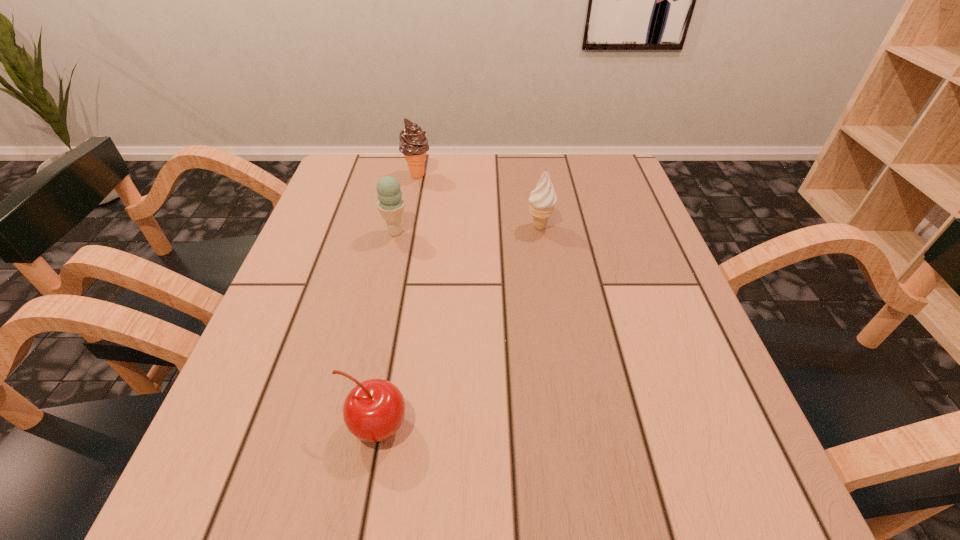
Where is `the farthest object`? the farthest object is located at coordinates pyautogui.click(x=413, y=143).

Identify the location of the rightmost ice cream. (542, 200).

The width and height of the screenshot is (960, 540). What are the coordinates of `the nearest object` in the screenshot? It's located at (374, 409).

I want to click on the shortest object, so click(x=374, y=409).

Identify the location of free region located 0.130m on the left of the farthest object. (354, 175).

The height and width of the screenshot is (540, 960). Find the location of `vacant space located 0.280m on the front-facing side of the rightmost object`. vacant space located 0.280m on the front-facing side of the rightmost object is located at coordinates (404, 227).

Identify the location of vacant space located 0.190m on the front-facing side of the rightmost object. The height and width of the screenshot is (540, 960). (444, 227).

Identify the location of vacant area located 0.300m on the front-facing side of the rightmost object. The width and height of the screenshot is (960, 540). (396, 227).

Locate an element on the screen. This screenshot has height=540, width=960. vacant space located on the back of the cherry is located at coordinates (396, 310).

This screenshot has width=960, height=540. Find the location of `object that is at the far edge`. object that is at the far edge is located at coordinates (413, 143).